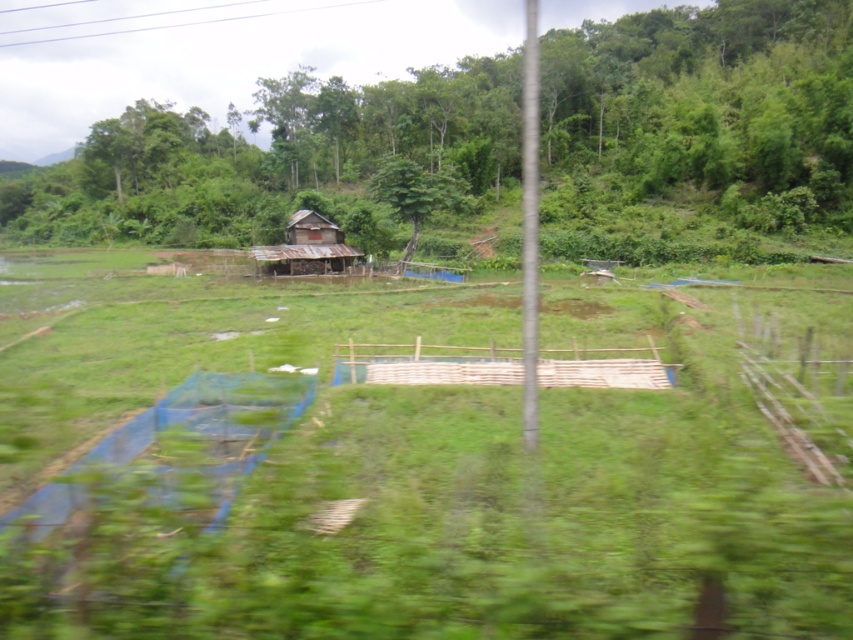
Question: Which point appears farthest from the camera in this image?

Choices:
 (A) (331, 225)
 (B) (744, 109)

Answer: (B)

Question: Which object is positioned closest to the green grass at center?

Choices:
 (A) rusty wood hut at center
 (B) green leafy tree at center

Answer: (A)

Question: Does green grass at center appear on the left side of green leafy tree at center?

Choices:
 (A) no
 (B) yes

Answer: (A)

Question: Does green grass at center come in front of green leafy tree at center?

Choices:
 (A) no
 (B) yes

Answer: (B)

Question: Is the position of green grass at center less distant than that of green leafy tree at center?

Choices:
 (A) yes
 (B) no

Answer: (A)

Question: Which point is closer to the camera?

Choices:
 (A) green grass at center
 (B) rusty wood hut at center

Answer: (A)